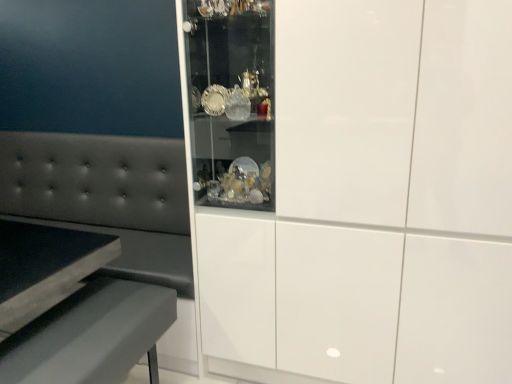
Describe the element at coordinates (350, 187) in the screenshot. I see `white glossy cabinet at center` at that location.

What is the approximate width of white glossy cabinet at center?

22.10 inches.

Image resolution: width=512 pixels, height=384 pixels. I want to click on matte gray table at lower left, so click(91, 336).

Identify the location of white glossy cabinet at center. (350, 187).

From a real-world perspective, which object rests below the other?

matte gray table at lower left is physically lower.

Does tufted leather couch at left have a lesser height compared to matte gray table at lower left?

No.

Based on their positions, is tufted leather couch at left located to the left or right of matte gray table at lower left?

tufted leather couch at left is to the left of matte gray table at lower left.

Between tufted leather couch at left and matte gray table at lower left, which one has smaller size?

matte gray table at lower left is smaller.

This screenshot has height=384, width=512. What are the coordinates of `cabinetry that is above the matte gray table at lower left (from a real-world perspective)` in the screenshot? It's located at (350, 187).

Is matte gray table at lower left with white glossy cabinet at center?

No, matte gray table at lower left is not touching white glossy cabinet at center.

From the image's perspective, would you say matte gray table at lower left is shown under white glossy cabinet at center?

Indeed, from the image's perspective, matte gray table at lower left is shown beneath white glossy cabinet at center.

Who is smaller, matte gray table at lower left or white glossy cabinet at center?

matte gray table at lower left.

From a real-world perspective, is matte gray table at lower left on tufted leather couch at left?

Actually, matte gray table at lower left is physically below tufted leather couch at left in the real world.

Which object is wider, matte gray table at lower left or tufted leather couch at left?

tufted leather couch at left.

Is tufted leather couch at left at the back of matte gray table at lower left?

matte gray table at lower left is not turned away from tufted leather couch at left.

Is point (174, 304) positioned in front of point (142, 258)?

Yes, point (174, 304) is in front of point (142, 258).

Where is `couch located behind the white glossy cabinet at center`? The height and width of the screenshot is (384, 512). couch located behind the white glossy cabinet at center is located at coordinates (106, 197).

Is white glossy cabinet at center positioned beyond the bounds of tufted leather couch at left?

white glossy cabinet at center is positioned outside tufted leather couch at left.

Is white glossy cabinet at center wider than tufted leather couch at left?

Correct, the width of white glossy cabinet at center exceeds that of tufted leather couch at left.

Is white glossy cabinet at center far away from tufted leather couch at left?

white glossy cabinet at center is actually quite close to tufted leather couch at left.

Can you tell me how much white glossy cabinet at center and matte gray table at lower left differ in facing direction?

91.9 degrees separate the facing orientations of white glossy cabinet at center and matte gray table at lower left.

From the picture: Is white glossy cabinet at center positioned behind matte gray table at lower left?

No, the depth of white glossy cabinet at center is less than that of matte gray table at lower left.

You are a GUI agent. You are given a task and a screenshot of the screen. Output one action in this format:
    pyautogui.click(x=<x>, y=<y>)
    Task: Click on the table located on the left of white glossy cabinet at center
    The image size is (512, 384).
    Given the screenshot: What is the action you would take?
    pyautogui.click(x=91, y=336)

Considering the sizes of objects white glossy cabinet at center and matte gray table at lower left in the image provided, who is wider, white glossy cabinet at center or matte gray table at lower left?

white glossy cabinet at center.

Considering the relative sizes of tufted leather couch at left and white glossy cabinet at center in the image provided, is tufted leather couch at left shorter than white glossy cabinet at center?

Yes.

Visually, is tufted leather couch at left positioned to the left or to the right of white glossy cabinet at center?

tufted leather couch at left is to the left of white glossy cabinet at center.

Is tufted leather couch at left positioned before white glossy cabinet at center?

That is False.

From a real-world perspective, which is physically above, tufted leather couch at left or white glossy cabinet at center?

white glossy cabinet at center is physically above.

This screenshot has width=512, height=384. What are the coordinates of `couch that is above the matte gray table at lower left (from a real-world perspective)` in the screenshot? It's located at (106, 197).

This screenshot has width=512, height=384. I want to click on cabinetry lying above the matte gray table at lower left (from the image's perspective), so click(350, 187).

Based on their spatial positions, is matte gray table at lower left or tufted leather couch at left further from white glossy cabinet at center?

Among the two, tufted leather couch at left is located further to white glossy cabinet at center.

Which object lies further to the anchor point matte gray table at lower left, tufted leather couch at left or white glossy cabinet at center?

Based on the image, white glossy cabinet at center appears to be further to matte gray table at lower left.

Estimate the real-world distances between objects in this image. Which object is further from tufted leather couch at left, white glossy cabinet at center or matte gray table at lower left?

Based on the image, white glossy cabinet at center appears to be further to tufted leather couch at left.

From the image, which object appears to be nearer to matte gray table at lower left, white glossy cabinet at center or tufted leather couch at left?

tufted leather couch at left is positioned closer to the anchor matte gray table at lower left.

Looking at the image, which one is located further to tufted leather couch at left, matte gray table at lower left or white glossy cabinet at center?

white glossy cabinet at center is positioned further to the anchor tufted leather couch at left.

From the image, which object appears to be nearer to white glossy cabinet at center, tufted leather couch at left or matte gray table at lower left?

matte gray table at lower left lies closer to white glossy cabinet at center than the other object.

Locate an element on the screen. This screenshot has height=384, width=512. table located between tufted leather couch at left and white glossy cabinet at center in the left-right direction is located at coordinates (91, 336).